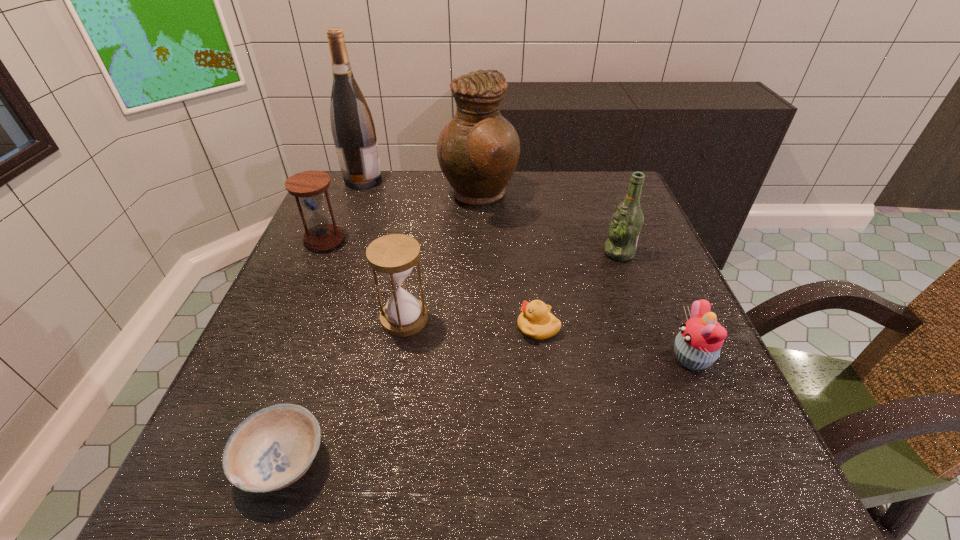
Locate an element on the screen. The width and height of the screenshot is (960, 540). wine bottle is located at coordinates (352, 126).

At what (x,y) coordinates should I click in order to perform the action: click on the seventh shortest object. Please return your answer as a coordinate pair (x, y). This screenshot has width=960, height=540. Looking at the image, I should click on (478, 150).

Where is `beer bottle`? Image resolution: width=960 pixels, height=540 pixels. beer bottle is located at coordinates (625, 226).

Identify the location of the right hourglass. (394, 256).

Locate an element on the screen. This screenshot has height=540, width=960. the left hourglass is located at coordinates (308, 185).

Where is `the sixth tallest object`? Image resolution: width=960 pixels, height=540 pixels. the sixth tallest object is located at coordinates (697, 346).

What are the coordinates of `duckling` in the screenshot? It's located at (536, 322).

Find the location of a particular element. The width and height of the screenshot is (960, 540). the shortest object is located at coordinates (271, 449).

Locate an element on the screen. Image resolution: width=960 pixels, height=540 pixels. bowl is located at coordinates (271, 449).

The height and width of the screenshot is (540, 960). In order to click on vacant space situated on the label of the wine bottle in this screenshot , I will do `click(446, 180)`.